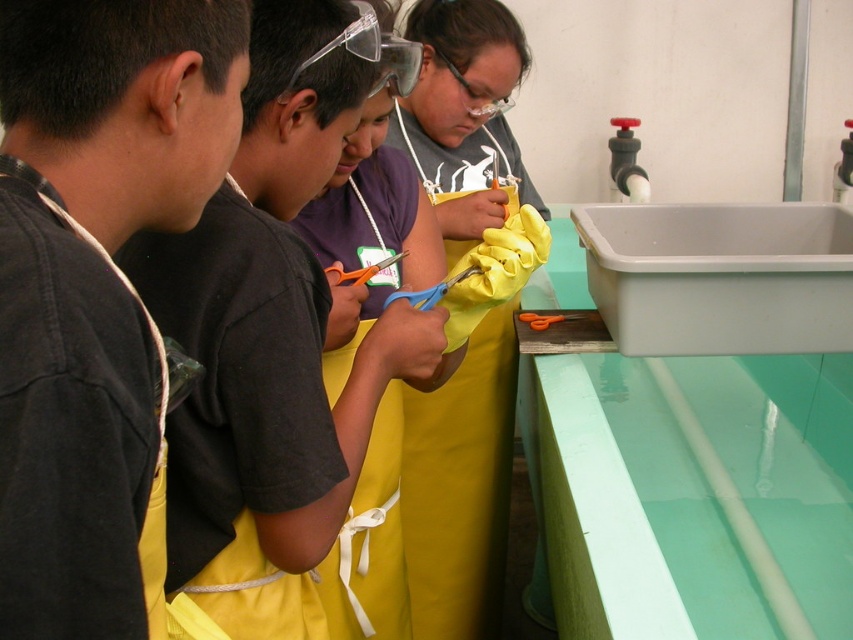
Based on the scene description, where is the black fabric apron at left located in the image?

The black fabric apron at left is located at point (93, 282) in the image.